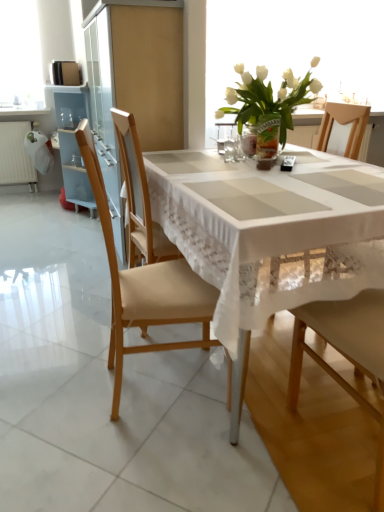
The image size is (384, 512). Identify the location of vacant space in front of white glass vase at upper center. (294, 169).